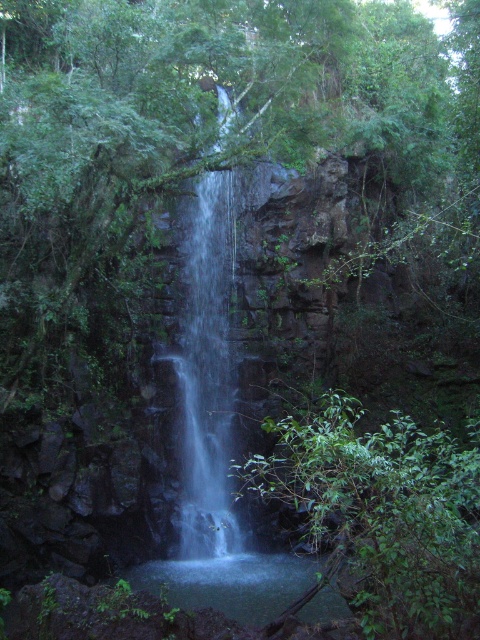
Question: Which point is farther to the camera?

Choices:
 (A) (202, 556)
 (B) (302, 465)

Answer: (A)

Question: Is green leafy tree at center thinner than clear water at center?

Choices:
 (A) yes
 (B) no

Answer: (B)

Question: Does green leafy tree at center have a greater width compared to clear water at center?

Choices:
 (A) yes
 (B) no

Answer: (A)

Question: Among these objects, which one is nearest to the camera?

Choices:
 (A) green leafy tree at center
 (B) clear water at center

Answer: (A)

Question: Does green leafy tree at center appear under clear water at center?

Choices:
 (A) yes
 (B) no

Answer: (A)